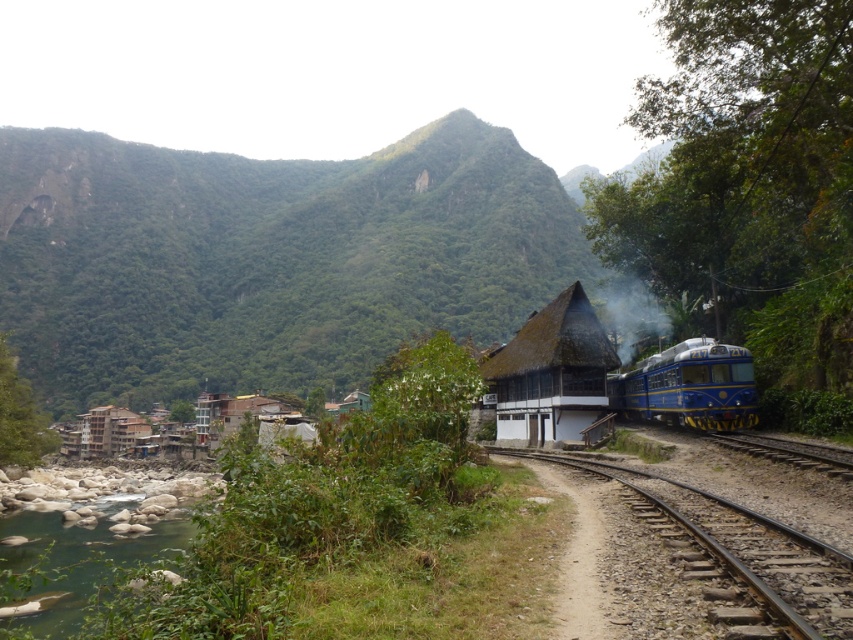
You are a hiker standing on the dirt path parallel to the railway tracks. You see the blue polished metal train at right approaching you. If you need to cross the tracks before the train arrives, how much distance do you have to cover to reach the nearest safe point beyond the tracks?

The blue polished metal train at right is 88.59 feet away from the dirt path. To cross safely, you need to reach the nearest safe point beyond the tracks before the train arrives.

Consider the image. You are standing at the dirt path parallel to the railway tracks and want to reach the blue train with yellow accents. You see two points marked in the scene. Which point is closer to you? The points are point (x=154, y=333) and point (x=509, y=364).

Point (x=154, y=333) is closer to you because it is further to the viewer than point (x=509, y=364).